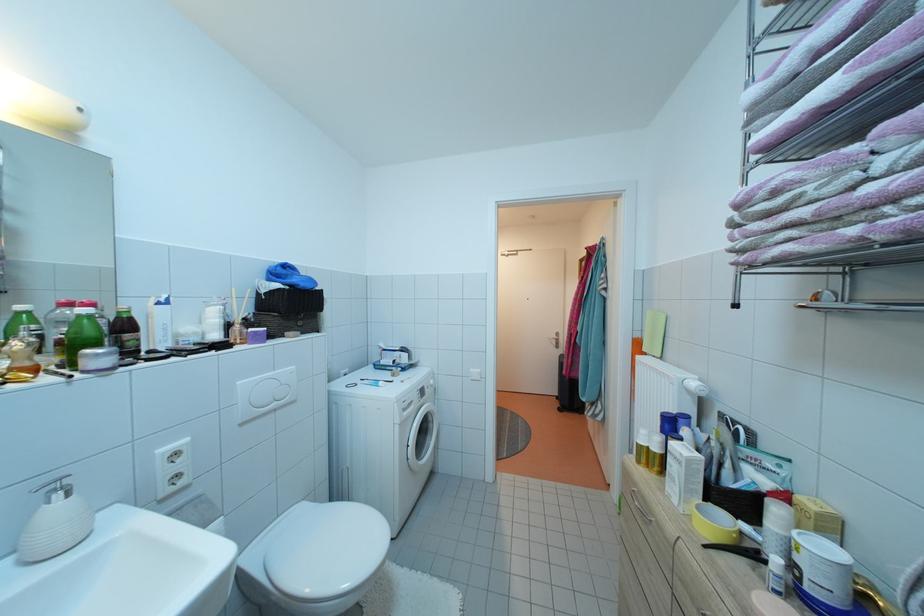
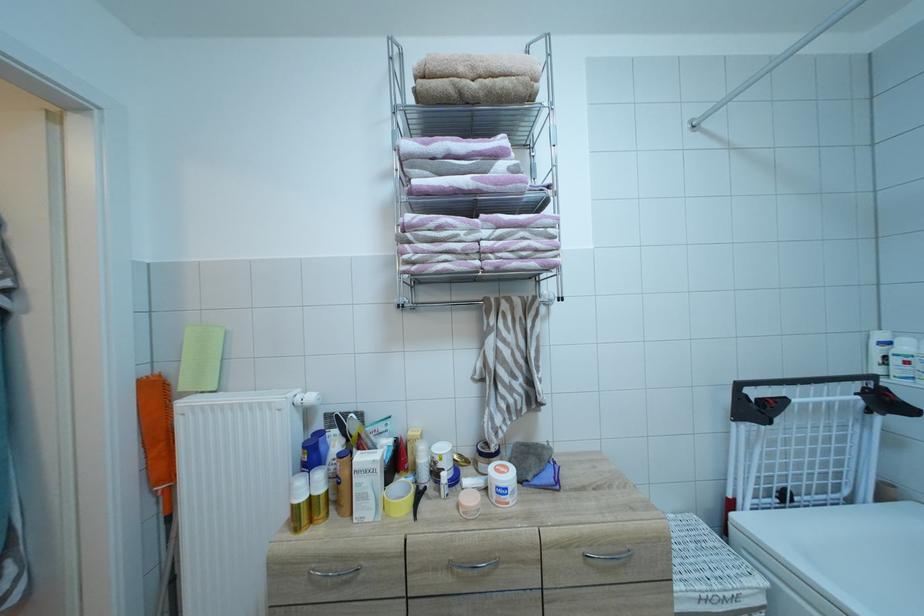
Question: The first image is from the beginning of the video and the second image is from the end. How did the camera likely rotate when shooting the video?

Choices:
 (A) Left
 (B) Right
 (C) Up
 (D) Down

Answer: (B)